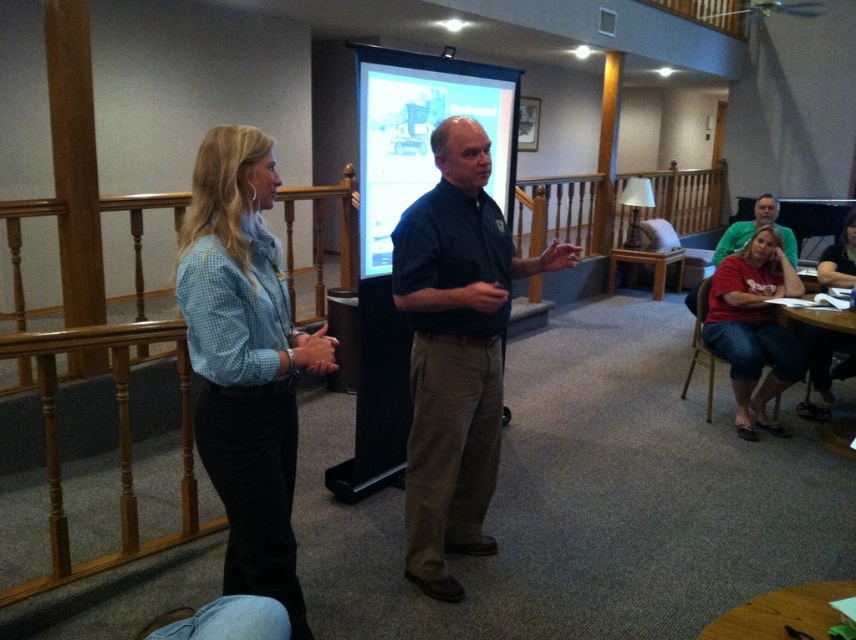
You are an event organizer setting up a presentation. You have a matte black projector screen at center and a red cotton shirt at lower right. Which object should you focus on adjusting first if you need to ensure visibility for the audience? Explain your reasoning based on their sizes.

The matte black projector screen at center is bigger than the red cotton shirt at lower right, so you should focus on adjusting the matte black projector screen at center first to ensure proper visibility since its larger size makes it more prominent and critical for the presentation.

You are an event planner setting up a stage for a presentation. The stage has a dark blue shirt at center and a matte black projector screen at center. Which object should be placed higher to ensure the presenter is visible to the audience?

The dark blue shirt at center should be placed higher than the matte black projector screen at center since the dark blue shirt at center is taller than the matte black projector screen at center.

Based on the scene description, where is the matte black projector screen at center located in terms of coordinates?

The matte black projector screen at center is located at coordinates point (423, 134).